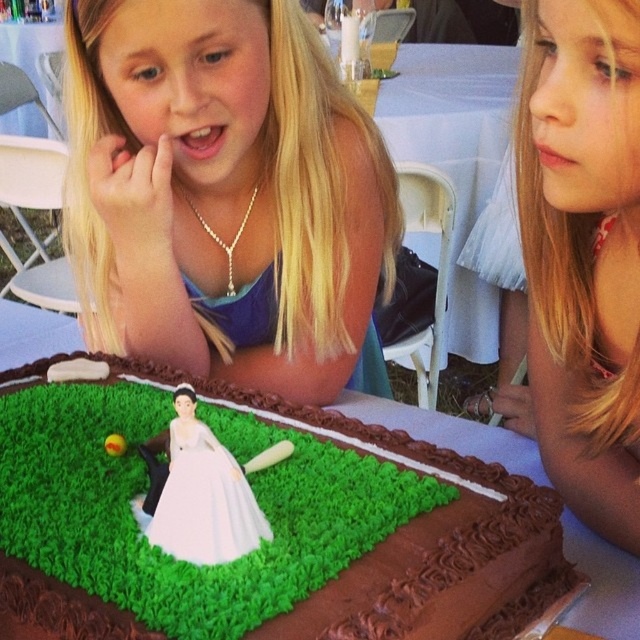
You are a photographer at the birthday party and want to take a closeup shot of the chocolate fondant baseball field at center without the blonde hair at upper right blocking the view. Is this possible?

The chocolate fondant baseball field at center is further to the viewer than blonde hair at upper right, so the blonde hair at upper right is closer to the photographer. This means the blonde hair at upper right would block the view of the chocolate fondant baseball field at center in a closeup shot.